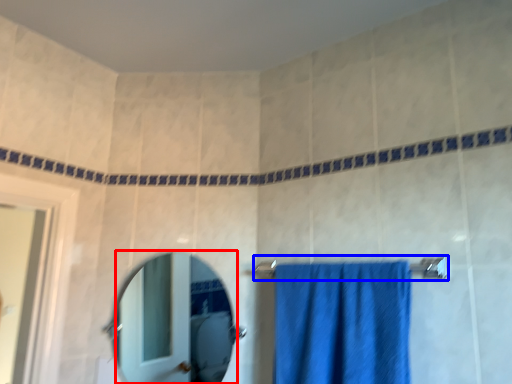
Question: Which point is further to the camera, mirror (highlighted by a red box) or towel bar (highlighted by a blue box)?

Choices:
 (A) mirror
 (B) towel bar

Answer: (A)